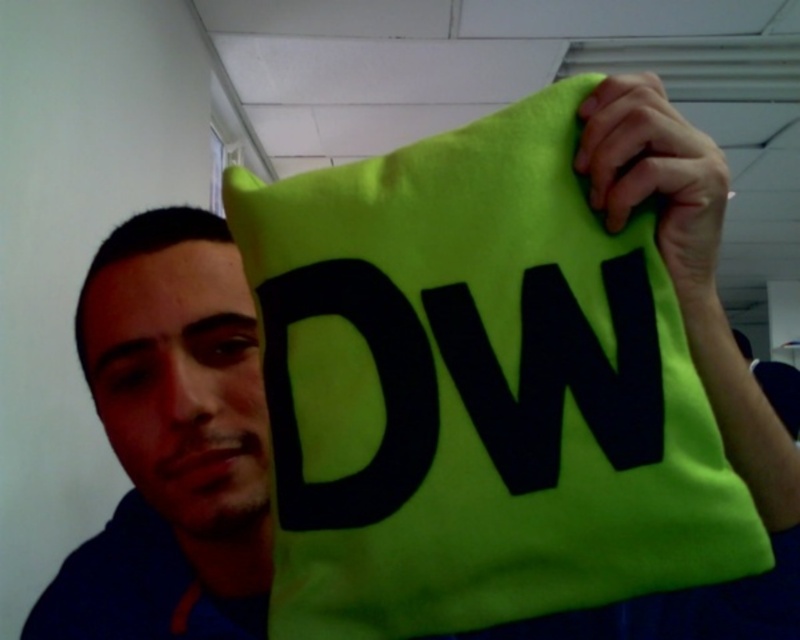
Which of these two, neon green fabric pillow at upper right or matte blue shirt at left, stands taller?

matte blue shirt at left

Between point (400, 308) and point (220, 593), which one is positioned in front?

Positioned in front is point (400, 308).

Image resolution: width=800 pixels, height=640 pixels. Find the location of `neon green fabric pillow at upper right`. neon green fabric pillow at upper right is located at coordinates (478, 390).